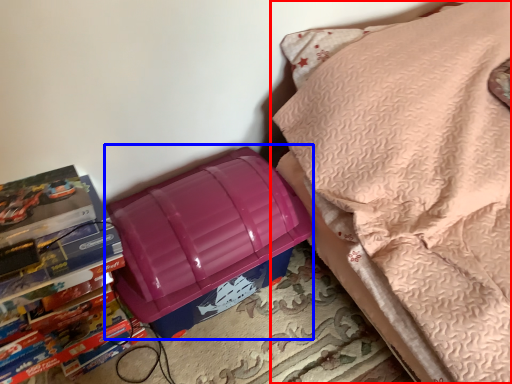
Question: Which point is further to the camera, furniture (highlighted by a red box) or lunch box (highlighted by a blue box)?

Choices:
 (A) furniture
 (B) lunch box

Answer: (B)